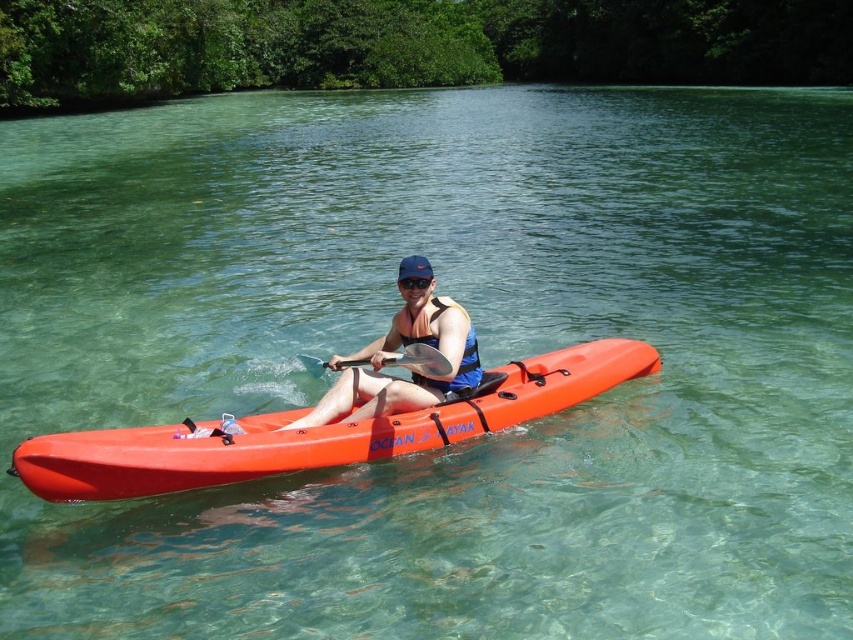
You are a kayaker trying to store your equipment in a waterproof compartment that can only accommodate items narrower than the transparent plastic goggles at center. Can you fit the wooden paddle at center into this compartment?

The wooden paddle at center is wider than the transparent plastic goggles at center, so it cannot fit into the waterproof compartment designed for narrower items.

You are a safety inspector checking the kayak setup. The safety regulations require that the life vest must be within arm reach of the person. Can you confirm if the matte blue life vest at center is within arm reach of the person in the kayak?

The matte blue life vest at center is located at point (410, 368). Since the person is in the kayak and the life vest is at the center, it is likely within arm reach as the kayak is a small vessel. Therefore, the life vest is within arm reach of the person in the kayak.

Looking at this image, you are the kayaker in the image. You want to look at your goggles without moving your head. Can you see the transparent plastic goggles at center through the wooden paddle at center?

The wooden paddle at center is in front of transparent plastic goggles at center, so yes, you can see the transparent plastic goggles at center through the wooden paddle at center because the paddle is in front but transparent.